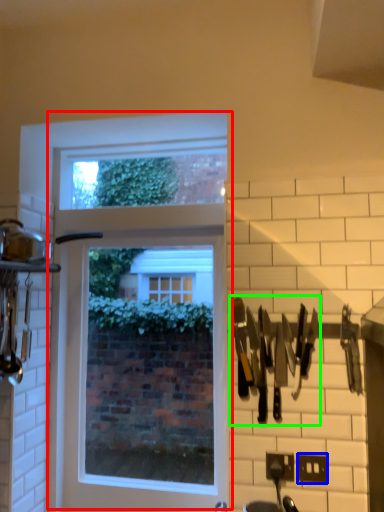
Question: Which object is positioned farthest from window (highlighted by a red box)? Select from electric outlet (highlighted by a blue box) and cutlery (highlighted by a green box).

Choices:
 (A) electric outlet
 (B) cutlery

Answer: (A)